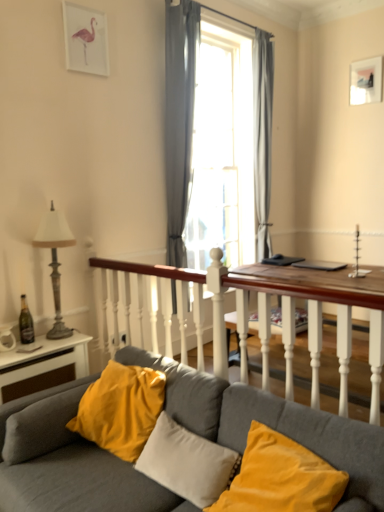
Find the location of a particular element. This screenshot has width=384, height=512. velvet gray couch at lower left is located at coordinates (67, 463).

Describe the element at coordinates (67, 463) in the screenshot. I see `velvet gray couch at lower left` at that location.

Image resolution: width=384 pixels, height=512 pixels. Describe the element at coordinates (180, 117) in the screenshot. I see `transparent glass window at center` at that location.

Measure the distance between transparent glass window at center and camera.

They are 3.25 meters apart.

Locate an element on the screen. velvet yellow pillow at center, which is counted as the second pillow, starting from the right is located at coordinates (187, 462).

In order to click on velvet yellow pillow at lower center, which appears as the 2th pillow when viewed from the left in this screenshot , I will do `click(281, 477)`.

From a real-world perspective, count 2nd pillows downward from the gray fabric curtain at right, which appears as the first curtain when viewed from the right, and point to it. Please provide its 2D coordinates.

[(187, 462)]

Is gray fabric curtain at right, which appears as the second curtain when viewed from the left, to the left or to the right of velvet yellow pillow at center, which is the 1th pillow from left to right, in the image?

gray fabric curtain at right, which appears as the second curtain when viewed from the left, is to the right of velvet yellow pillow at center, which is the 1th pillow from left to right.

From a real-world perspective, between gray fabric curtain at right, which is counted as the 1th curtain, starting from the back, and velvet yellow pillow at center, which is counted as the second pillow, starting from the right, who is vertically higher?

gray fabric curtain at right, which is counted as the 1th curtain, starting from the back.

Which object is thinner, gray fabric curtain at right, which appears as the first curtain when viewed from the right, or velvet yellow pillow at center, which is the 1th pillow from left to right?

With smaller width is gray fabric curtain at right, which appears as the first curtain when viewed from the right.

Considering the points (360, 73) and (13, 409), which point is in front, point (360, 73) or point (13, 409)?

The point (13, 409) is closer.

Is matte white picture frame at upper right smaller than velvet gray couch at lower left?

Yes.

From the image's perspective, between matte white picture frame at upper right and velvet gray couch at lower left, who is located below?

velvet gray couch at lower left is shown below in the image.

Based on the photo, between matte white picture frame at upper right and velvet gray couch at lower left, which one has smaller width?

Thinner between the two is matte white picture frame at upper right.

In the scene shown: From a real-world perspective, does velvet gray couch at lower left sit lower than gray fabric curtain at right, which is the 2th curtain in front-to-back order?

Yes, from a real-world perspective, velvet gray couch at lower left is under gray fabric curtain at right, which is the 2th curtain in front-to-back order.

Can you confirm if velvet gray couch at lower left is wider than gray fabric curtain at right, which appears as the second curtain when viewed from the left?

Correct, the width of velvet gray couch at lower left exceeds that of gray fabric curtain at right, which appears as the second curtain when viewed from the left.

This screenshot has width=384, height=512. I want to click on studio couch in front of the gray fabric curtain at right, which appears as the second curtain when viewed from the left, so click(x=67, y=463).

Consider the image. How distant is velvet gray couch at lower left from gray fabric curtain at right, which is counted as the 1th curtain, starting from the back?

2.94 meters.

Is transparent glass window at center turned away from velvet yellow pillow at lower center, the first pillow when ordered from right to left?

transparent glass window at center does not have its back to velvet yellow pillow at lower center, the first pillow when ordered from right to left.

Between transparent glass window at center and velvet yellow pillow at lower center, which appears as the 2th pillow when viewed from the left, which one has more height?

transparent glass window at center.

From the image's perspective, which object appears higher, transparent glass window at center or velvet yellow pillow at lower center, which appears as the 2th pillow when viewed from the left?

transparent glass window at center is shown above in the image.

Consider the image. Measure the distance from transparent glass window at center to velvet yellow pillow at lower center, the first pillow when ordered from right to left.

transparent glass window at center is 7.27 feet from velvet yellow pillow at lower center, the first pillow when ordered from right to left.

From a real-world perspective, is gray sheer curtain at center, the 2th curtain positioned from the back, positioned under velvet gray couch at lower left based on gravity?

No.

The width and height of the screenshot is (384, 512). In the image, there is a gray sheer curtain at center, arranged as the 1th curtain when viewed from the left. What are the coordinates of `studio couch below it (from the image's perspective)` in the screenshot? It's located at (67, 463).

From the image's perspective, is gray sheer curtain at center, which is the 1th curtain from front to back, below velvet gray couch at lower left?

Incorrect, from the image's perspective, gray sheer curtain at center, which is the 1th curtain from front to back, is higher than velvet gray couch at lower left.

Who is taller, gray sheer curtain at center, which is the 1th curtain from front to back, or velvet gray couch at lower left?

gray sheer curtain at center, which is the 1th curtain from front to back, is taller.

Would you say gray sheer curtain at center, the 2th curtain positioned from the back, is to the left or to the right of transparent glass window at center in the picture?

gray sheer curtain at center, the 2th curtain positioned from the back, is to the left of transparent glass window at center.

From the image's perspective, who appears lower, gray sheer curtain at center, the 2th curtain positioned from the back, or transparent glass window at center?

transparent glass window at center, from the image's perspective.

Does gray sheer curtain at center, arranged as the 1th curtain when viewed from the left, contain transparent glass window at center?

No, gray sheer curtain at center, arranged as the 1th curtain when viewed from the left, does not contain transparent glass window at center.

Is the depth of gray sheer curtain at center, which is the 1th curtain from front to back, less than that of transparent glass window at center?

Yes.

Is point (377, 65) farther from viewer compared to point (181, 65)?

Yes, it is.

Would you say matte white picture frame at upper right is outside gray sheer curtain at center, the 2th curtain positioned from the back?

Yes, matte white picture frame at upper right is located beyond the bounds of gray sheer curtain at center, the 2th curtain positioned from the back.

What's the angular difference between matte white picture frame at upper right and gray sheer curtain at center, the 2th curtain positioned from the back,'s facing directions?

The facing directions of matte white picture frame at upper right and gray sheer curtain at center, the 2th curtain positioned from the back, are 90 degrees apart.

From a real-world perspective, which object rests below the other?

From a 3D spatial view, gray sheer curtain at center, arranged as the 1th curtain when viewed from the left, is below.

This screenshot has height=512, width=384. In order to click on the 2nd pillow positioned below the gray fabric curtain at right, which is counted as the 1th curtain, starting from the back (from the image's perspective) in this screenshot , I will do `click(187, 462)`.

Locate an element on the screen. picture frame above the velvet gray couch at lower left (from a real-world perspective) is located at coordinates (366, 81).

Estimate the real-world distances between objects in this image. Which object is further from velvet gray couch at lower left, metallic gray lamp at left or velvet yellow pillow at center, which is counted as the second pillow, starting from the right?

Based on the image, metallic gray lamp at left appears to be further to velvet gray couch at lower left.

Which object lies nearer to the anchor point gray sheer curtain at center, arranged as the 1th curtain when viewed from the left, velvet yellow pillow at lower center, which appears as the 2th pillow when viewed from the left, or gray fabric curtain at right, which is counted as the 1th curtain, starting from the back?

gray fabric curtain at right, which is counted as the 1th curtain, starting from the back, lies closer to gray sheer curtain at center, arranged as the 1th curtain when viewed from the left, than the other object.

Looking at the image, which one is located closer to metallic gray lamp at left, matte white picture frame at upper right or velvet yellow pillow at center, which is counted as the second pillow, starting from the right?

Based on the image, velvet yellow pillow at center, which is counted as the second pillow, starting from the right, appears to be nearer to metallic gray lamp at left.

Estimate the real-world distances between objects in this image. Which object is further from transparent glass window at center, matte white picture frame at upper right or velvet yellow pillow at lower center, which appears as the 2th pillow when viewed from the left?

The object further to transparent glass window at center is velvet yellow pillow at lower center, which appears as the 2th pillow when viewed from the left.

From the image, which object appears to be farther from gray fabric curtain at right, which appears as the first curtain when viewed from the right, velvet yellow pillow at lower center, which appears as the 2th pillow when viewed from the left, or transparent glass window at center?

velvet yellow pillow at lower center, which appears as the 2th pillow when viewed from the left.

Which object lies further to the anchor point matte white picture frame at upper right, gray sheer curtain at center, the 2th curtain positioned from the back, or transparent glass window at center?

Based on the image, gray sheer curtain at center, the 2th curtain positioned from the back, appears to be further to matte white picture frame at upper right.

Looking at the image, which one is located further to matte white picture frame at upper right, velvet yellow pillow at center, which is the 1th pillow from left to right, or velvet yellow pillow at lower center, the first pillow when ordered from right to left?

velvet yellow pillow at center, which is the 1th pillow from left to right, lies further to matte white picture frame at upper right than the other object.

Considering their positions, is velvet yellow pillow at lower center, which appears as the 2th pillow when viewed from the left, positioned closer to velvet gray couch at lower left than transparent glass window at center?

velvet yellow pillow at lower center, which appears as the 2th pillow when viewed from the left.

You are a GUI agent. You are given a task and a screenshot of the screen. Output one action in this format:
    pyautogui.click(x=<x>, y=<y>)
    Task: Click on the lamp between velvet yellow pillow at lower center, the first pillow when ordered from right to left, and gray fabric curtain at right, which appears as the second curtain when viewed from the left, along the z-axis
    This screenshot has width=384, height=512.
    Given the screenshot: What is the action you would take?
    pyautogui.click(x=55, y=261)

Where is `pillow between velvet gray couch at lower left and velvet yellow pillow at center, which is counted as the second pillow, starting from the right, along the z-axis`? pillow between velvet gray couch at lower left and velvet yellow pillow at center, which is counted as the second pillow, starting from the right, along the z-axis is located at coordinates (281, 477).

The height and width of the screenshot is (512, 384). In order to click on lamp located between velvet yellow pillow at center, which is the 1th pillow from left to right, and gray fabric curtain at right, which is counted as the 1th curtain, starting from the back, in the depth direction in this screenshot , I will do `click(55, 261)`.

The height and width of the screenshot is (512, 384). I want to click on lamp between velvet gray couch at lower left and gray sheer curtain at center, marked as the 2th curtain in a right-to-left arrangement, from front to back, so click(55, 261).